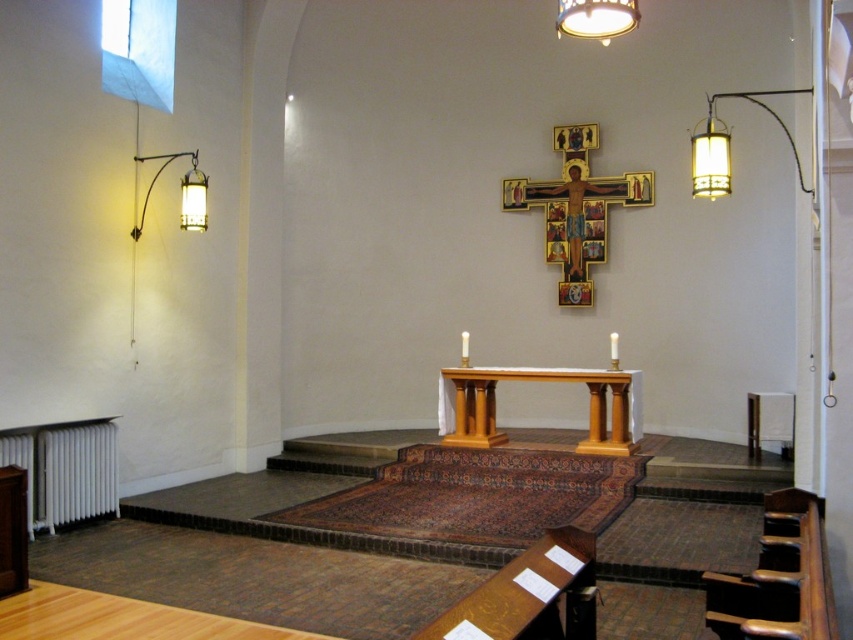
Question: Among these objects, which one is nearest to the camera?

Choices:
 (A) wooden altar at center
 (B) matte white lampshade at upper center

Answer: (B)

Question: Is wooden altar at center below matte white lampshade at upper center?

Choices:
 (A) yes
 (B) no

Answer: (A)

Question: Can you confirm if white ceramic lamp at upper right is positioned to the left of metallic wall-mounted light fixture at left?

Choices:
 (A) yes
 (B) no

Answer: (B)

Question: Which object appears closest to the camera in this image?

Choices:
 (A) matte white lampshade at upper center
 (B) wooden altar at center
 (C) white ceramic lamp at upper right

Answer: (A)

Question: Does white ceramic lamp at upper right have a lesser width compared to metallic wall-mounted light fixture at left?

Choices:
 (A) no
 (B) yes

Answer: (B)

Question: Among these objects, which one is farthest from the camera?

Choices:
 (A) white ceramic lamp at upper right
 (B) metallic wall-mounted light fixture at left

Answer: (B)